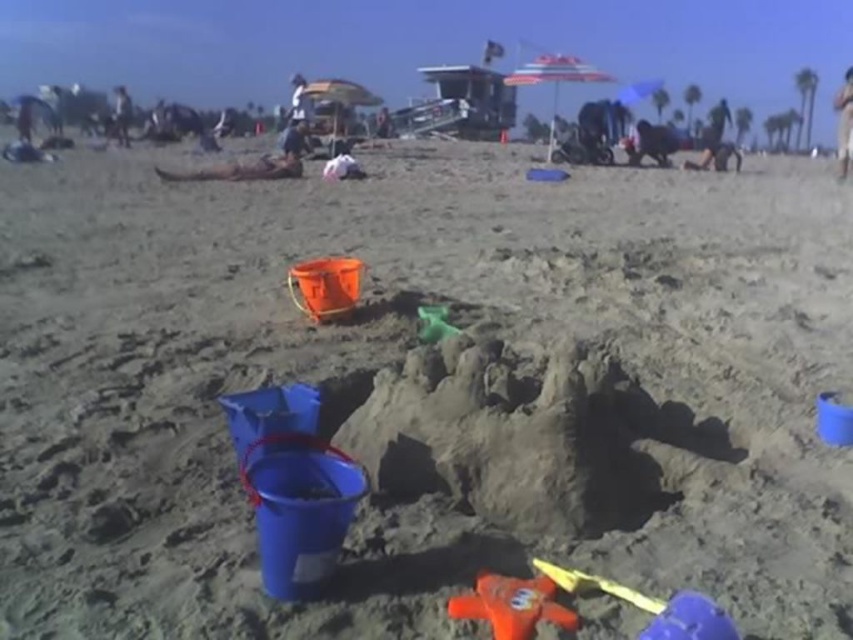
How far apart are rubber orange starfish at center and green rubber toy at center?

rubber orange starfish at center and green rubber toy at center are 6.79 feet apart from each other.

Is rubber orange starfish at center to the right of green rubber toy at center from the viewer's perspective?

Yes, rubber orange starfish at center is to the right of green rubber toy at center.

The image size is (853, 640). I want to click on rubber orange starfish at center, so click(511, 604).

Measure the distance from rubber orange starfish at center to smooth tan skin at upper right.

rubber orange starfish at center and smooth tan skin at upper right are 14.76 meters apart from each other.

Does point (476, 600) come farther from viewer compared to point (833, 102)?

No, it is in front of (833, 102).

Image resolution: width=853 pixels, height=640 pixels. What are the coordinates of `rubber orange starfish at center` in the screenshot? It's located at (511, 604).

Consider the image. Is blue rubber toy at lower right to the left of brown wooden surfboard at upper center from the viewer's perspective?

In fact, blue rubber toy at lower right is to the right of brown wooden surfboard at upper center.

Who is lower down, blue rubber toy at lower right or brown wooden surfboard at upper center?

blue rubber toy at lower right is below.

Image resolution: width=853 pixels, height=640 pixels. Describe the element at coordinates (689, 620) in the screenshot. I see `blue rubber toy at lower right` at that location.

At what (x,y) coordinates should I click in order to perform the action: click on blue rubber toy at lower right. Please return your answer as a coordinate pair (x, y). The image size is (853, 640). Looking at the image, I should click on (689, 620).